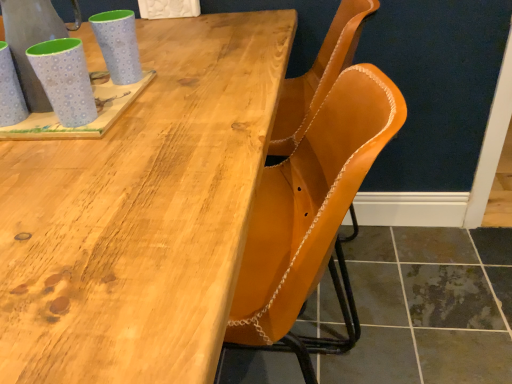
At what (x,y) coordinates should I click in order to perform the action: click on vacant area located to the right-hand side of brushed metal pitcher at upper left. Please return your answer as a coordinate pair (x, y). Image resolution: width=512 pixels, height=384 pixels. Looking at the image, I should click on (165, 97).